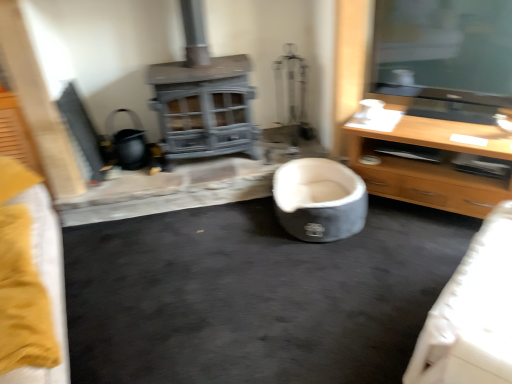
I want to click on vacant space positioned to the left of soft gray fabric bean bag at center, so click(238, 235).